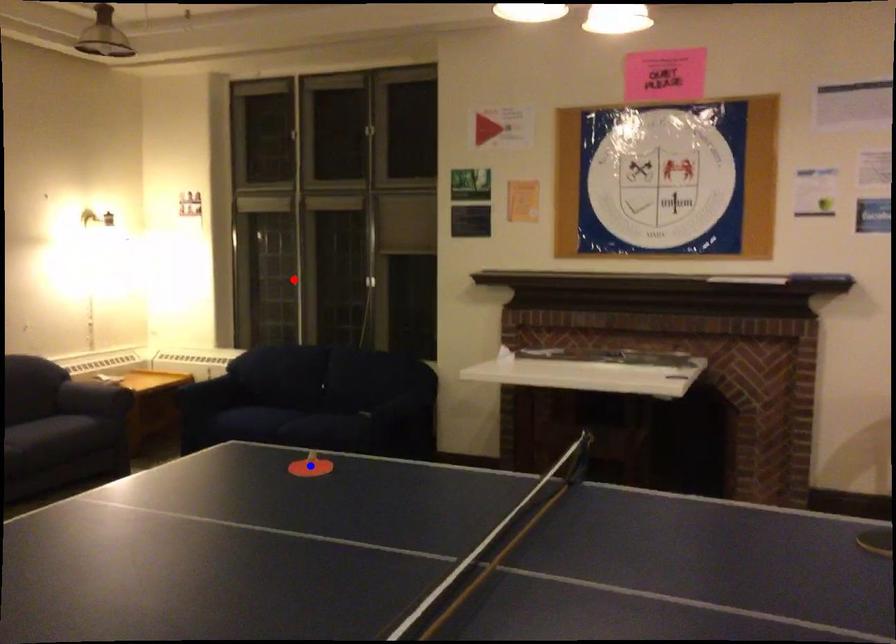
Question: In the image, two points are highlighted. Which point is nearer to the camera? Reply with the corresponding letter.

Choices:
 (A) blue point
 (B) red point

Answer: (A)